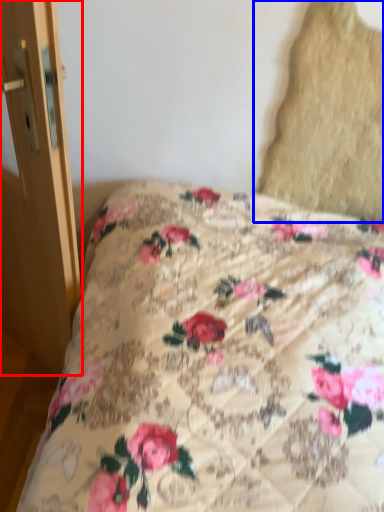
Question: Which object appears closest to the camera in this image, screen door (highlighted by a red box) or pillow (highlighted by a blue box)?

Choices:
 (A) screen door
 (B) pillow

Answer: (A)